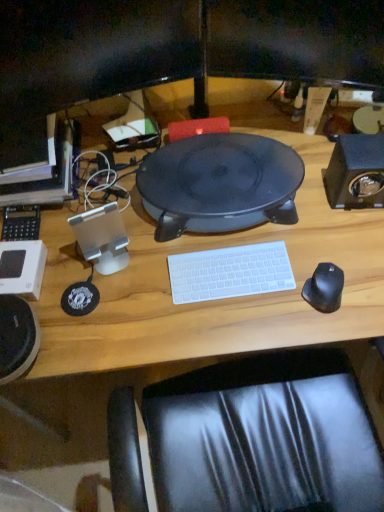
You are a GUI agent. You are given a task and a screenshot of the screen. Output one action in this format:
    pyautogui.click(x=<x>, y=<y>)
    Task: Click on the free space between black matte mouse at right and white plastic keyboard at center
    This screenshot has width=384, height=512.
    Given the screenshot: What is the action you would take?
    pyautogui.click(x=270, y=293)